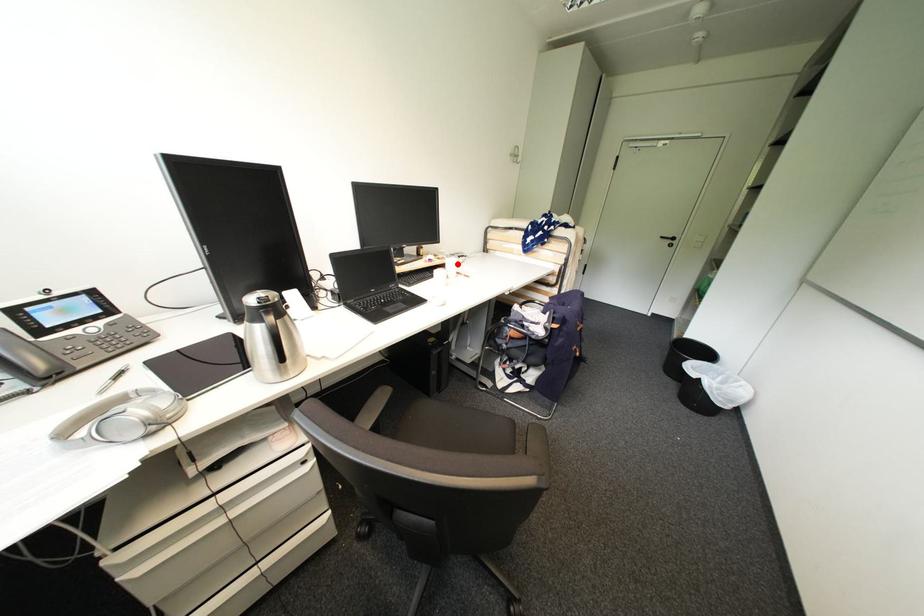
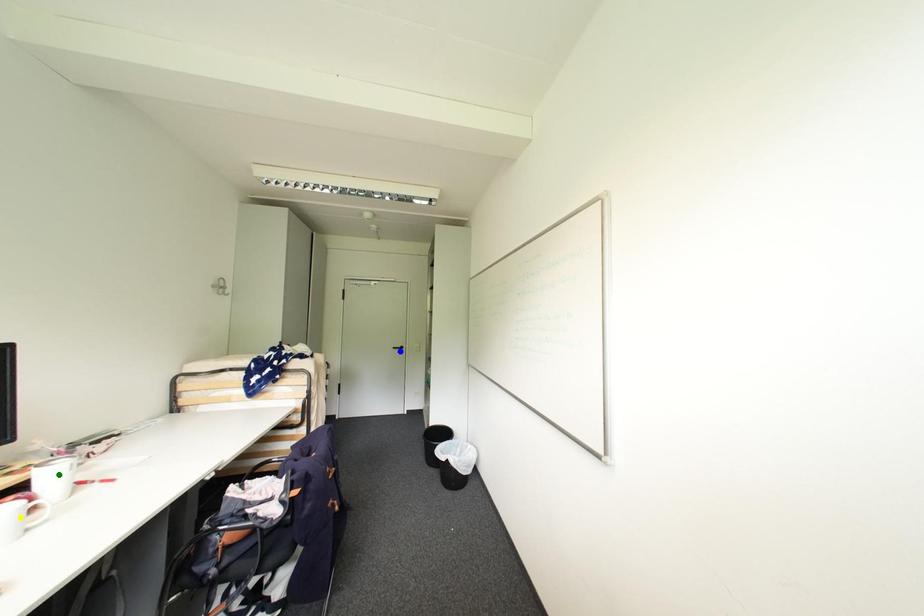
Question: I am providing you with two images of the same scene from different viewpoints. A red point is marked on the first image. You are given multiple points on the second image. Which mark in image 2 goes with the point in image 1?

Choices:
 (A) green point
 (B) yellow point
 (C) blue point

Answer: (A)